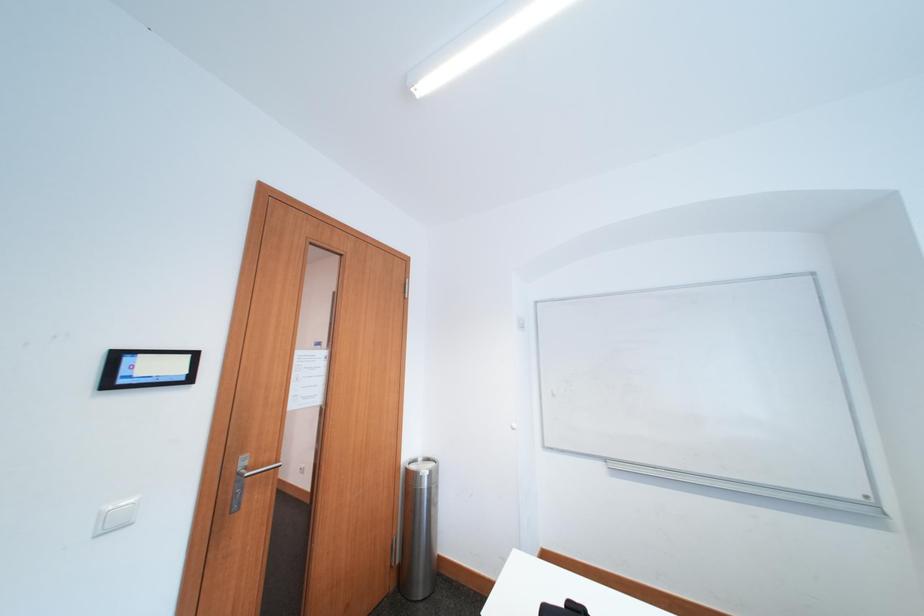
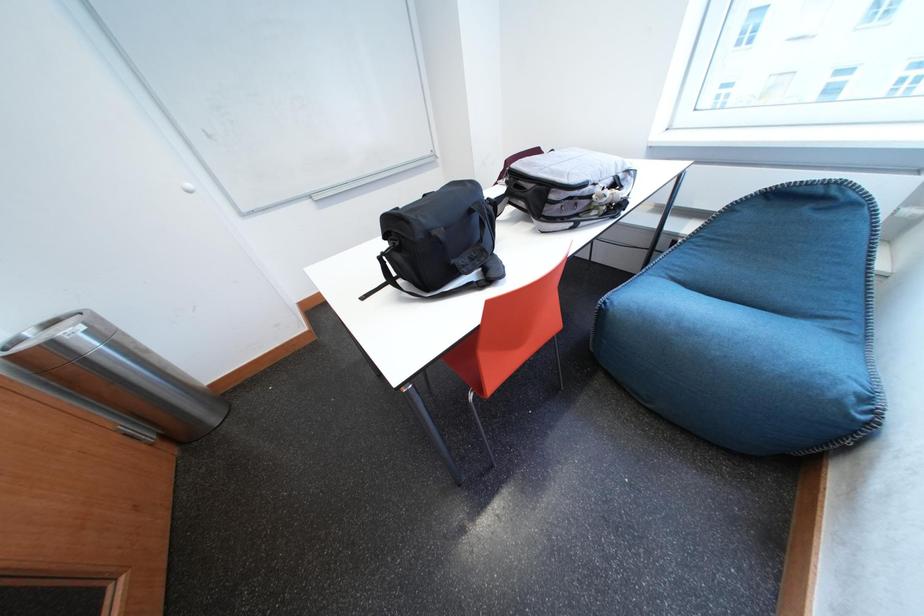
Based on the continuous images, in which direction is the camera rotating?

The camera rotated toward right-down.